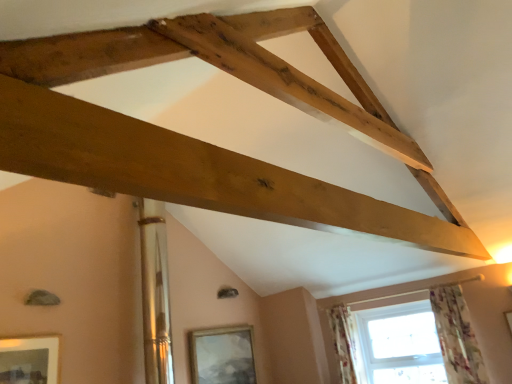
What do you see at coordinates (193, 172) in the screenshot?
I see `natural wood beam at upper center` at bounding box center [193, 172].

What do you see at coordinates (457, 336) in the screenshot? The width and height of the screenshot is (512, 384). I see `floral fabric curtain at lower right, placed as the 2th curtain when sorted from back to front` at bounding box center [457, 336].

Describe the element at coordinates (456, 335) in the screenshot. This screenshot has width=512, height=384. I see `clear glass window at lower right` at that location.

Find the location of a particular element. The image size is (512, 384). clear glass window at lower right is located at coordinates (456, 335).

Locate an element on the screen. The width and height of the screenshot is (512, 384). floral fabric curtain at lower right, marked as the first curtain in a back-to-front arrangement is located at coordinates (343, 342).

In order to click on natural wood beam at upper center in this screenshot , I will do `click(193, 172)`.

How many degrees apart are the facing directions of floral fabric curtain at lower right, the 1th curtain when ordered from right to left, and clear glass window at lower right?

0.00286 degrees.

Is floral fabric curtain at lower right, the second curtain viewed from the left, positioned beyond the bounds of clear glass window at lower right?

Yes.

Which object is thinner, floral fabric curtain at lower right, the second curtain viewed from the left, or clear glass window at lower right?

With smaller width is clear glass window at lower right.

Is floral fabric curtain at lower right, the second curtain viewed from the left, further to the viewer compared to clear glass window at lower right?

No.

Can you tell me how much natural wood beam at upper center and clear glass window at lower right differ in facing direction?

They differ by 88 degrees in their facing directions.

You are a GUI agent. You are given a task and a screenshot of the screen. Output one action in this format:
    pyautogui.click(x=<x>, y=<y>)
    Task: Click on the plank lying in front of the clear glass window at lower right
    This screenshot has height=384, width=512.
    Given the screenshot: What is the action you would take?
    pyautogui.click(x=193, y=172)

Is natural wood beam at upper center looking in the opposite direction of clear glass window at lower right?

That's not correct — natural wood beam at upper center is not looking away from clear glass window at lower right.

Is natural wood beam at upper center in front of or behind clear glass window at lower right in the image?

natural wood beam at upper center is positioned closer to the viewer than clear glass window at lower right.

Is natural wood beam at upper center with matte silver picture frame at lower center, the second picture frame positioned from the left?

No, natural wood beam at upper center is not next to matte silver picture frame at lower center, the second picture frame positioned from the left.

From a real-world perspective, which object stands above the other?

natural wood beam at upper center.

Could you tell me if natural wood beam at upper center is facing matte silver picture frame at lower center, placed as the second picture frame when sorted from front to back?

No, natural wood beam at upper center is not oriented towards matte silver picture frame at lower center, placed as the second picture frame when sorted from front to back.

Considering the sizes of objects natural wood beam at upper center and matte silver picture frame at lower center, placed as the second picture frame when sorted from front to back, in the image provided, who is bigger, natural wood beam at upper center or matte silver picture frame at lower center, placed as the second picture frame when sorted from front to back,?

With larger size is natural wood beam at upper center.

Considering the sizes of objects clear glass window at lower right and matte silver picture frame at lower center, the second picture frame positioned from the left, in the image provided, who is thinner, clear glass window at lower right or matte silver picture frame at lower center, the second picture frame positioned from the left,?

Thinner between the two is clear glass window at lower right.

From the image's perspective, which one is positioned lower, clear glass window at lower right or matte silver picture frame at lower center, the second picture frame positioned from the left?

matte silver picture frame at lower center, the second picture frame positioned from the left, is shown below in the image.

Between clear glass window at lower right and matte silver picture frame at lower center, the second picture frame viewed from the top, which one has smaller size?

With smaller size is clear glass window at lower right.

Which of these two, floral fabric curtain at lower right, positioned as the second curtain in right-to-left order, or floral fabric curtain at lower right, the second curtain viewed from the left, stands taller?

floral fabric curtain at lower right, the second curtain viewed from the left.

Based on the photo, from a real-world perspective, is floral fabric curtain at lower right, positioned as the second curtain in right-to-left order, on floral fabric curtain at lower right, the 1th curtain when ordered from right to left?

Yes.

From the image's perspective, which one is positioned higher, floral fabric curtain at lower right, marked as the first curtain in a back-to-front arrangement, or floral fabric curtain at lower right, the first curtain when ordered from front to back?

floral fabric curtain at lower right, the first curtain when ordered from front to back, from the image's perspective.

Relative to clear glass window at lower right, is matte silver picture frame at lower center, the second picture frame positioned from the left, in front or behind?

In the image, matte silver picture frame at lower center, the second picture frame positioned from the left, appears in front of clear glass window at lower right.

Does matte silver picture frame at lower center, the second picture frame viewed from the top, contain clear glass window at lower right?

That's incorrect, clear glass window at lower right is not inside matte silver picture frame at lower center, the second picture frame viewed from the top.

Identify the location of picture frame that is the 1st object located in front of the clear glass window at lower right. (222, 355).

What's the angular difference between floral fabric curtain at lower right, placed as the 2th curtain when sorted from back to front, and floral fabric curtain at lower right, the first curtain viewed from the left,'s facing directions?

The angular difference between floral fabric curtain at lower right, placed as the 2th curtain when sorted from back to front, and floral fabric curtain at lower right, the first curtain viewed from the left, is 0.00314 degrees.

Who is bigger, floral fabric curtain at lower right, the 1th curtain when ordered from right to left, or floral fabric curtain at lower right, positioned as the second curtain in right-to-left order?

floral fabric curtain at lower right, the 1th curtain when ordered from right to left.

Which object is closer to the camera taking this photo, floral fabric curtain at lower right, the 1th curtain when ordered from right to left, or floral fabric curtain at lower right, arranged as the second curtain when viewed from the front?

floral fabric curtain at lower right, the 1th curtain when ordered from right to left, is closer to the camera.

From the picture: Is floral fabric curtain at lower right, the first curtain viewed from the left, at the back of floral fabric curtain at lower right, the first curtain when ordered from front to back?

No, floral fabric curtain at lower right, the first curtain viewed from the left, is not at the back of floral fabric curtain at lower right, the first curtain when ordered from front to back.

Find the location of a particular element. This screenshot has height=384, width=512. window on the left of the floral fabric curtain at lower right, the second curtain viewed from the left is located at coordinates click(x=456, y=335).

At what (x,y) coordinates should I click in order to perform the action: click on window located behind the natural wood beam at upper center. Please return your answer as a coordinate pair (x, y). Looking at the image, I should click on (456, 335).

Based on their spatial positions, is natural wood beam at upper center or matte silver picture frame at lower center, placed as the second picture frame when sorted from front to back, closer to clear glass window at lower right?

The object closer to clear glass window at lower right is natural wood beam at upper center.

Which object lies nearer to the anchor point floral fabric curtain at lower right, the first curtain viewed from the left, natural wood beam at upper center or clear glass window at lower right?

clear glass window at lower right lies closer to floral fabric curtain at lower right, the first curtain viewed from the left, than the other object.

Estimate the real-world distances between objects in this image. Which object is further from floral fabric curtain at lower right, arranged as the second curtain when viewed from the front, matte gold picture frame at lower left, which appears as the 2th picture frame when viewed from the back, or floral fabric curtain at lower right, the 1th curtain when ordered from right to left?

Among the two, matte gold picture frame at lower left, which appears as the 2th picture frame when viewed from the back, is located further to floral fabric curtain at lower right, arranged as the second curtain when viewed from the front.

Which object lies nearer to the anchor point floral fabric curtain at lower right, positioned as the second curtain in right-to-left order, floral fabric curtain at lower right, the second curtain viewed from the left, or clear glass window at lower right?

The object closer to floral fabric curtain at lower right, positioned as the second curtain in right-to-left order, is clear glass window at lower right.

When comparing their distances from matte gold picture frame at lower left, the second picture frame in the right-to-left sequence, does floral fabric curtain at lower right, marked as the first curtain in a back-to-front arrangement, or natural wood beam at upper center seem closer?

natural wood beam at upper center lies closer to matte gold picture frame at lower left, the second picture frame in the right-to-left sequence, than the other object.

Considering their positions, is natural wood beam at upper center positioned closer to matte silver picture frame at lower center, the second picture frame viewed from the top, than matte gold picture frame at lower left, the second picture frame in the right-to-left sequence?

Among the two, matte gold picture frame at lower left, the second picture frame in the right-to-left sequence, is located nearer to matte silver picture frame at lower center, the second picture frame viewed from the top.

Looking at the image, which one is located closer to matte silver picture frame at lower center, the second picture frame viewed from the top, clear glass window at lower right or matte gold picture frame at lower left, the second picture frame from the bottom?

Among the two, matte gold picture frame at lower left, the second picture frame from the bottom, is located nearer to matte silver picture frame at lower center, the second picture frame viewed from the top.

In the scene shown: Looking at the image, which one is located closer to matte gold picture frame at lower left, the second picture frame from the bottom, floral fabric curtain at lower right, positioned as the second curtain in right-to-left order, or matte silver picture frame at lower center, the second picture frame positioned from the left?

The object closer to matte gold picture frame at lower left, the second picture frame from the bottom, is matte silver picture frame at lower center, the second picture frame positioned from the left.

Identify the location of window between matte silver picture frame at lower center, the second picture frame positioned from the left, and floral fabric curtain at lower right, the first curtain when ordered from front to back. pyautogui.click(x=456, y=335).

Where is `curtain positioned between natural wood beam at upper center and clear glass window at lower right from near to far`? This screenshot has height=384, width=512. curtain positioned between natural wood beam at upper center and clear glass window at lower right from near to far is located at coordinates (457, 336).

Where is `curtain located between matte gold picture frame at lower left, which appears as the 2th picture frame when viewed from the back, and clear glass window at lower right in the left-right direction`? The image size is (512, 384). curtain located between matte gold picture frame at lower left, which appears as the 2th picture frame when viewed from the back, and clear glass window at lower right in the left-right direction is located at coordinates (343, 342).

Where is `plank between matte gold picture frame at lower left, positioned as the 1th picture frame in left-to-right order, and floral fabric curtain at lower right, placed as the 2th curtain when sorted from back to front, in the horizontal direction`? This screenshot has height=384, width=512. plank between matte gold picture frame at lower left, positioned as the 1th picture frame in left-to-right order, and floral fabric curtain at lower right, placed as the 2th curtain when sorted from back to front, in the horizontal direction is located at coordinates (193, 172).